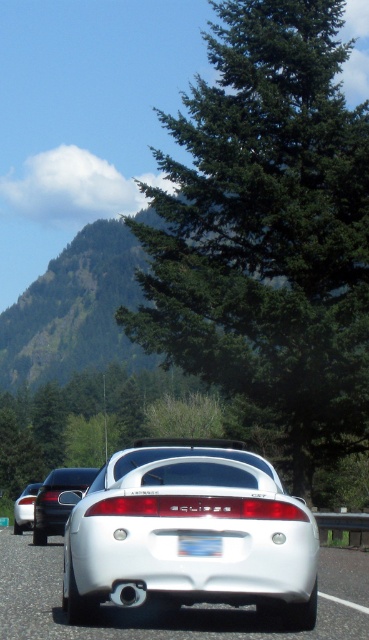
You are standing at the point marked by the coordinates point (190,532) in the image. What object are you directly facing?

→ The point (190,532) marks the white glossy sports car at center, so you are directly facing the white glossy sports car at center.

You are standing on the road next to the white Mitsubishi Eclipse sports car. You see two points marked on the road. The first point is at coordinate point (343, 548) and the second is at point (202, 548). Which point is closer to you?

Point (343, 548) is closer to you because it is further to the viewer than point (202, 548).